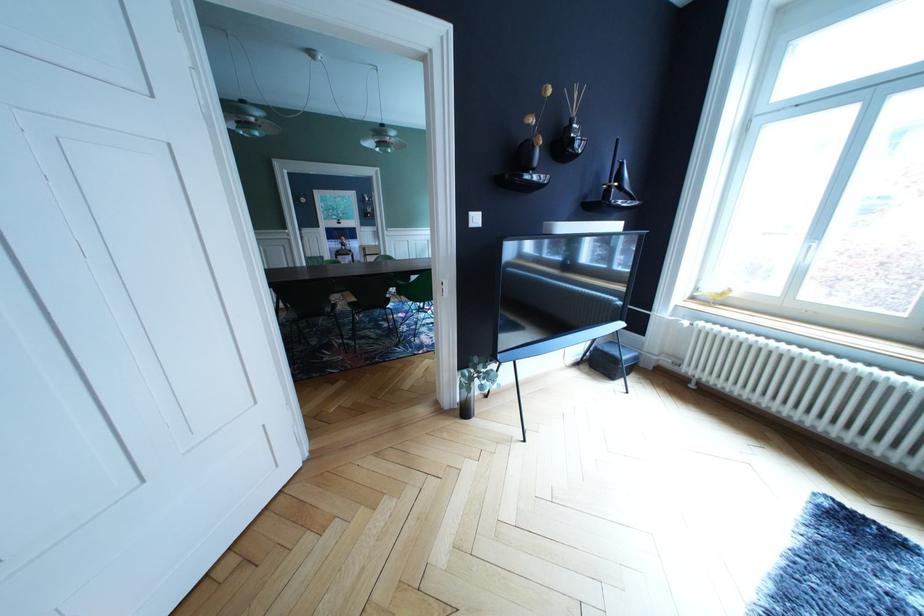
Where is `small woven box`? small woven box is located at coordinates (612, 359).